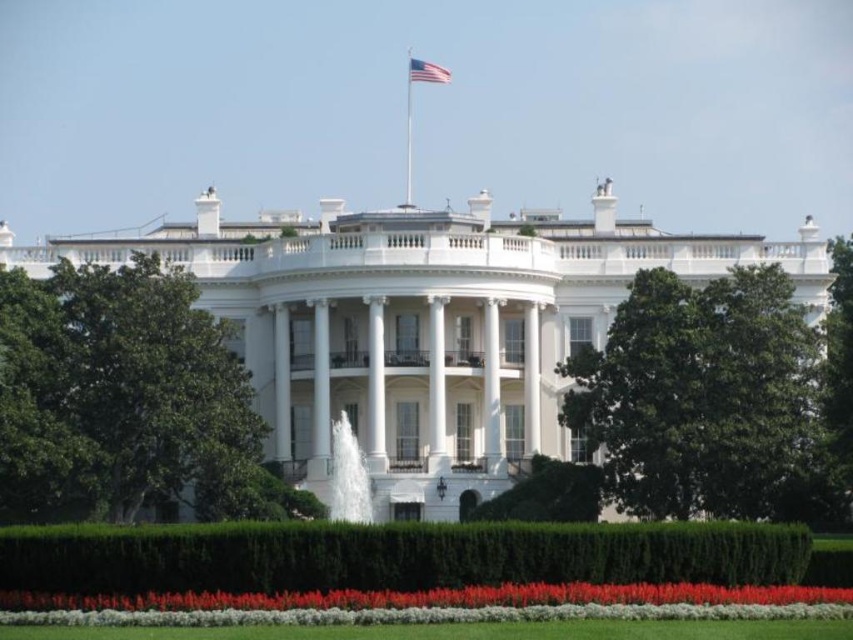
You are standing in front of the White House and notice the green leafy hedge at lower center and the metallic flag pole at upper center. Which object is positioned higher from the ground?

The metallic flag pole at upper center is positioned higher from the ground than the green leafy hedge at lower center.

You are standing in front of the White House and notice two green leafy hedges. One is labeled as the green leafy hedge at lower center and the other as the green leafy hedge at center. Which hedge is positioned to the left when facing the White House?

The green leafy hedge at lower center is positioned to the left of the green leafy hedge at center when facing the White House.